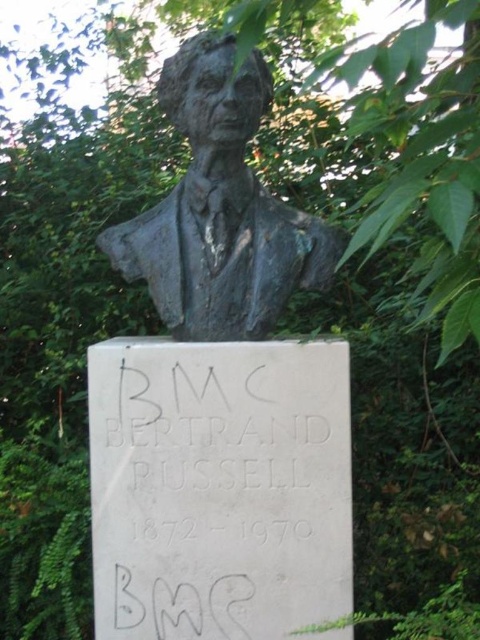
You are a sculptor examining the statue of Bertrand Russell. You notice the white stone plaque at center and the bronze bust at center. Which object is taller?

The bronze bust at center is taller than the white stone plaque at center.

From the picture: You are a tour guide explaining the statue of Bertrand Russell to a group. You need to mention the distance between the white stone plaque at center and the bronze bust at center. What do you tell them?

The white stone plaque at center is 13.89 inches away from the bronze bust at center.

You are an art conservator examining the bronze bust of Bertrand Russell. You notice a point at coordinates (218, 486) on the pedestal. What does this point correspond to?

The point at coordinates (218, 486) corresponds to the white stone plaque at center, which is inscribed with the text